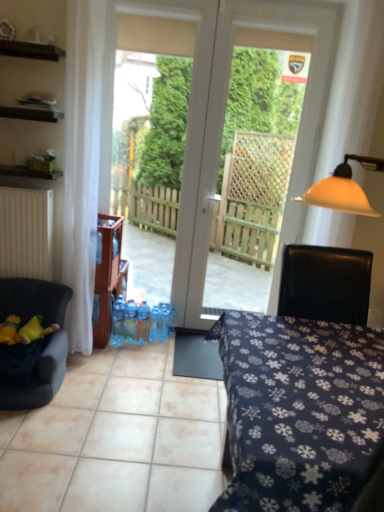
This screenshot has height=512, width=384. What are the coordinates of `free space on the front side of blue plastic bottle at center, the third bottle in the right-to-left sequence` in the screenshot? It's located at (141, 352).